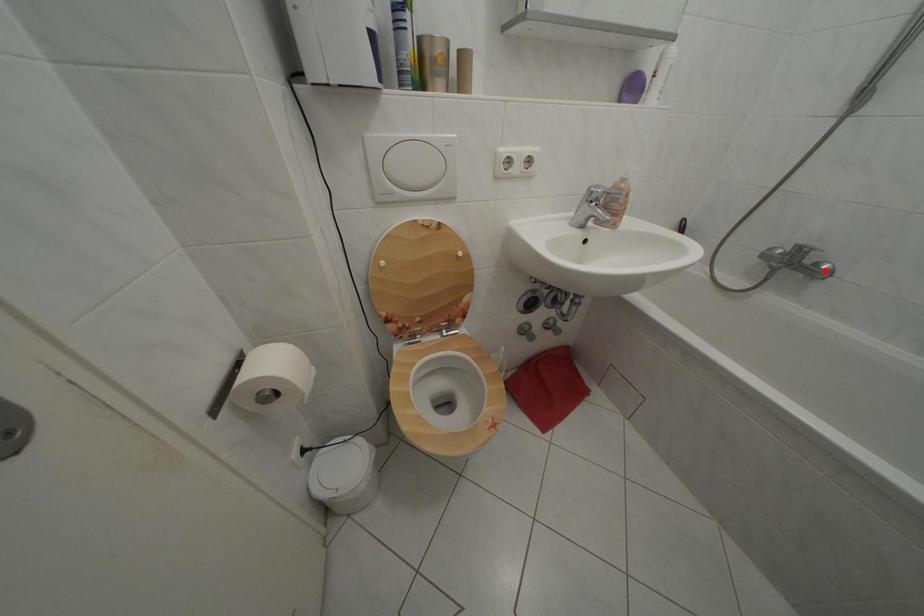
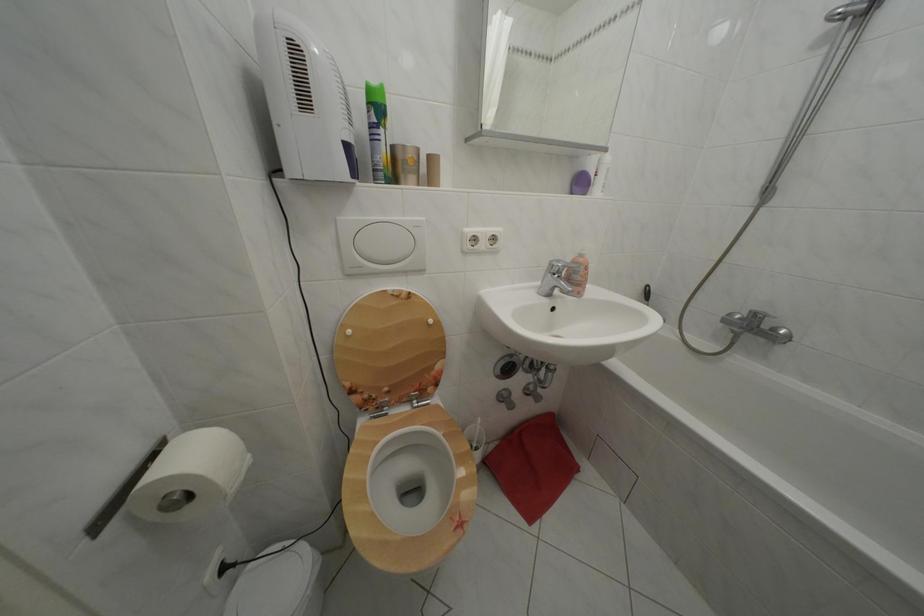
Locate, in the second image, the point that corresponds to the highlighted location in the first image.

(783, 336)